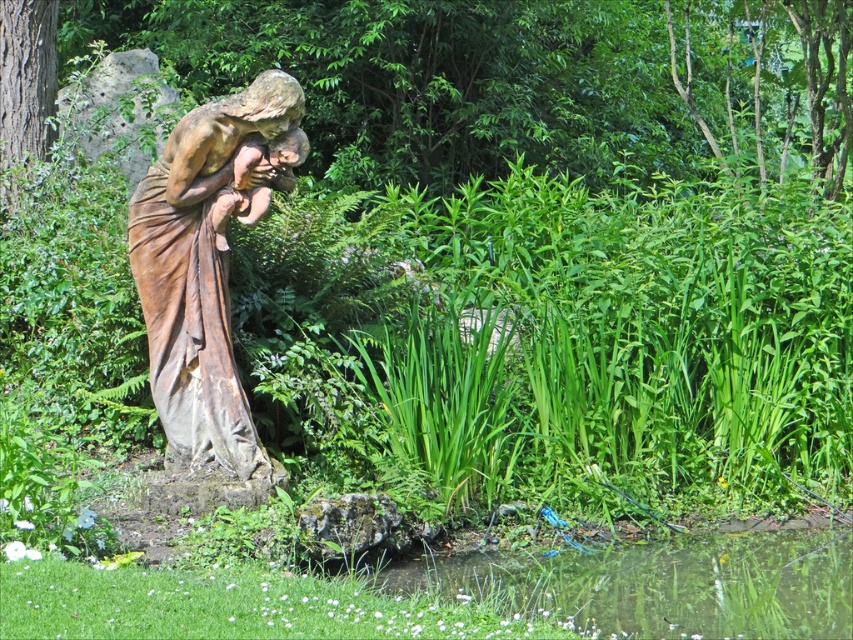
Question: Is brown stone statue at center wider than clear water at bottom right?

Choices:
 (A) no
 (B) yes

Answer: (A)

Question: Does brown stone statue at center come in front of clear water at bottom right?

Choices:
 (A) no
 (B) yes

Answer: (A)

Question: Can you confirm if brown stone statue at center is positioned above clear water at bottom right?

Choices:
 (A) yes
 (B) no

Answer: (A)

Question: Among these points, which one is farthest from the camera?

Choices:
 (A) (815, 616)
 (B) (219, 236)

Answer: (B)

Question: Which point is farther from the camera taking this photo?

Choices:
 (A) (224, 200)
 (B) (553, 596)

Answer: (A)